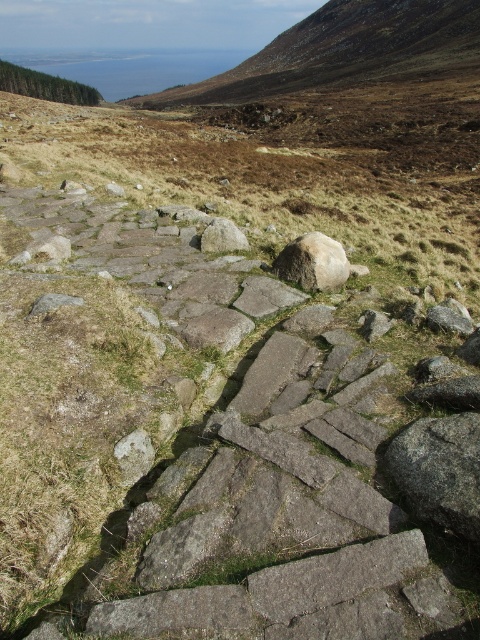
Who is positioned more to the right, brown rough stone at upper center or gray rough rock at center?

Positioned to the right is brown rough stone at upper center.

Is brown rough stone at upper center smaller than gray rough rock at center?

Incorrect, brown rough stone at upper center is not smaller in size than gray rough rock at center.

Is point (284, 45) closer to viewer compared to point (222, 243)?

No.

Where is `brown rough stone at upper center`? This screenshot has width=480, height=640. brown rough stone at upper center is located at coordinates (344, 49).

Does brown rough stone at upper center appear under white smooth rock at center?

Incorrect, brown rough stone at upper center is not positioned below white smooth rock at center.

Can you confirm if brown rough stone at upper center is positioned to the left of white smooth rock at center?

In fact, brown rough stone at upper center is to the right of white smooth rock at center.

Between point (358, 77) and point (312, 291), which one is positioned in front?

Point (312, 291) is in front.

The width and height of the screenshot is (480, 640). What are the coordinates of `brown rough stone at upper center` in the screenshot? It's located at (344, 49).

Does white smooth rock at center have a lesser width compared to gray rough rock at center?

In fact, white smooth rock at center might be wider than gray rough rock at center.

Between white smooth rock at center and gray rough rock at center, which one has less height?

Standing shorter between the two is gray rough rock at center.

Where is `white smooth rock at center`? white smooth rock at center is located at coordinates (312, 262).